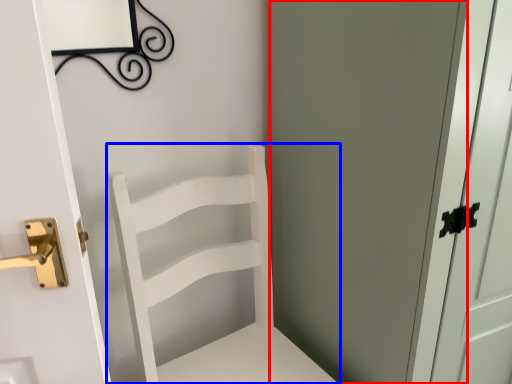
Question: Which object is further to the camera taking this photo, screen door (highlighted by a red box) or furniture (highlighted by a blue box)?

Choices:
 (A) screen door
 (B) furniture

Answer: (B)